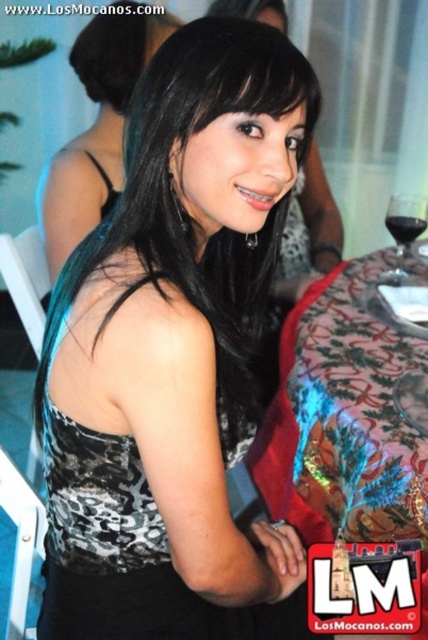
Can you confirm if black leopard print dress at center is positioned to the right of printed fabric tablecloth at lower right?

No, black leopard print dress at center is not to the right of printed fabric tablecloth at lower right.

Is black leopard print dress at center thinner than printed fabric tablecloth at lower right?

Correct, black leopard print dress at center's width is less than printed fabric tablecloth at lower right's.

Is point (172, 497) less distant than point (368, 442)?

Yes, point (172, 497) is closer to viewer.

The height and width of the screenshot is (640, 428). What are the coordinates of `black leopard print dress at center` in the screenshot? It's located at (172, 349).

Does printed fabric tablecloth at lower right have a lesser width compared to transparent glass at upper right?

Incorrect, printed fabric tablecloth at lower right's width is not less than transparent glass at upper right's.

Can you confirm if printed fabric tablecloth at lower right is positioned to the right of transparent glass at upper right?

Incorrect, printed fabric tablecloth at lower right is not on the right side of transparent glass at upper right.

Which is behind, point (398, 387) or point (422, 214)?

Point (422, 214)

Locate an element on the screen. Image resolution: width=428 pixels, height=640 pixels. printed fabric tablecloth at lower right is located at coordinates (356, 417).

Who is more forward, (270, 211) or (394, 230)?

Point (270, 211) is in front.

Which is above, black leopard print dress at center or transparent glass at upper right?

transparent glass at upper right

You are a GUI agent. You are given a task and a screenshot of the screen. Output one action in this format:
    pyautogui.click(x=<x>, y=<y>)
    Task: Click on the black leopard print dress at center
    This screenshot has width=428, height=640.
    Given the screenshot: What is the action you would take?
    pyautogui.click(x=172, y=349)